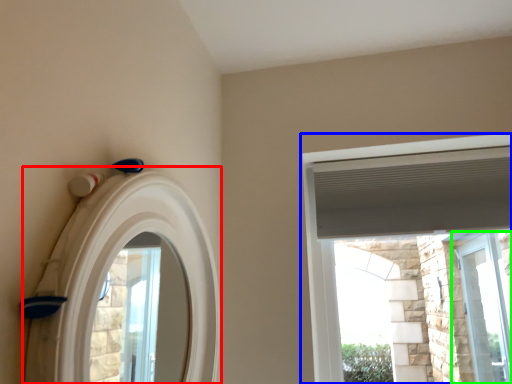
Question: Which object is the closest to the archway (highlighted by a red box)? Choose among these: window (highlighted by a blue box) or window (highlighted by a green box).

Choices:
 (A) window
 (B) window

Answer: (A)